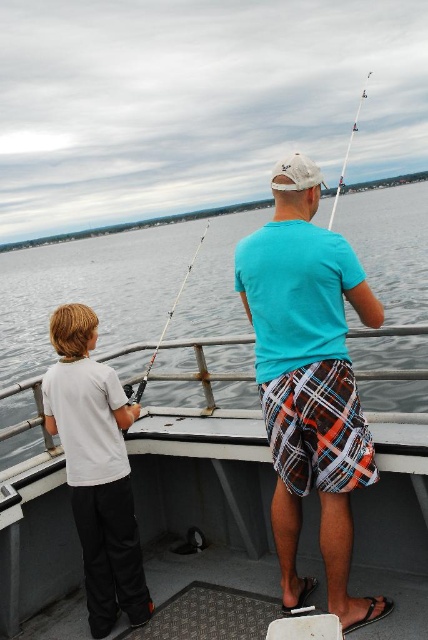
Looking at this image, does clear water at center have a larger size compared to white plastic fishing pole at upper right?

Indeed, clear water at center has a larger size compared to white plastic fishing pole at upper right.

Is the position of clear water at center more distant than that of white plastic fishing pole at upper right?

No, it is in front of white plastic fishing pole at upper right.

Find the location of `clear water at center`. clear water at center is located at coordinates (89, 291).

Find the location of a particular element. clear water at center is located at coordinates (89, 291).

Does white matte shirt at left have a lesser height compared to white plastic fishing pole at upper right?

Yes, white matte shirt at left is shorter than white plastic fishing pole at upper right.

Where is `white matte shirt at left`? This screenshot has width=428, height=640. white matte shirt at left is located at coordinates (95, 468).

Does point (92, 456) come farther from viewer compared to point (362, 92)?

No.

Identify the location of white matte shirt at left. (95, 468).

Can you confirm if teal cotton t-shirt at center is taller than white matte shirt at left?

Correct, teal cotton t-shirt at center is much taller as white matte shirt at left.

Is point (279, 387) positioned before point (67, 422)?

Yes, it is.

The image size is (428, 640). I want to click on teal cotton t-shirt at center, so click(x=309, y=380).